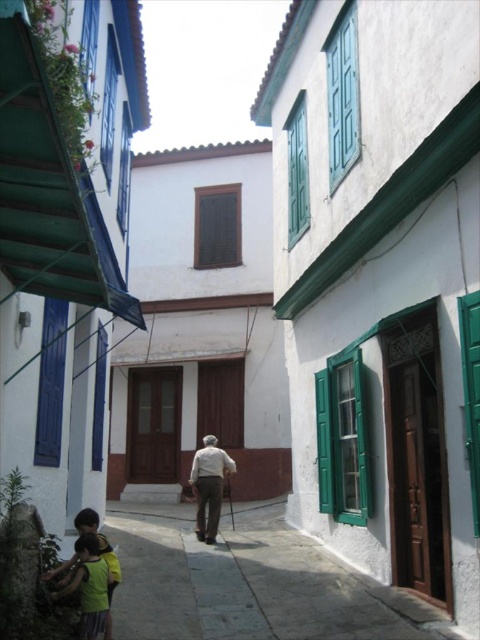
Question: Does yellow cotton shirt at lower left lie in front of white matte shirt at center?

Choices:
 (A) no
 (B) yes

Answer: (B)

Question: Which object is farther from the camera taking this photo?

Choices:
 (A) white matte shirt at center
 (B) green painted wood at upper center
 (C) smooth stone pavement at lower left
 (D) yellow cotton shirt at lower left

Answer: (A)

Question: Which of the following is the closest to the observer?

Choices:
 (A) green painted wood at upper center
 (B) brown wooden door at center
 (C) yellow cotton shirt at lower left
 (D) smooth stone pavement at lower left

Answer: (C)

Question: Is smooth stone pavement at lower left bigger than green painted wood at upper center?

Choices:
 (A) no
 (B) yes

Answer: (A)

Question: Considering the relative positions of green painted wood at upper center and yellow cotton shirt at lower left in the image provided, where is green painted wood at upper center located with respect to yellow cotton shirt at lower left?

Choices:
 (A) right
 (B) left

Answer: (A)

Question: Which point appears closest to the camera in this image?

Choices:
 (A) (88, 614)
 (B) (337, 36)

Answer: (A)